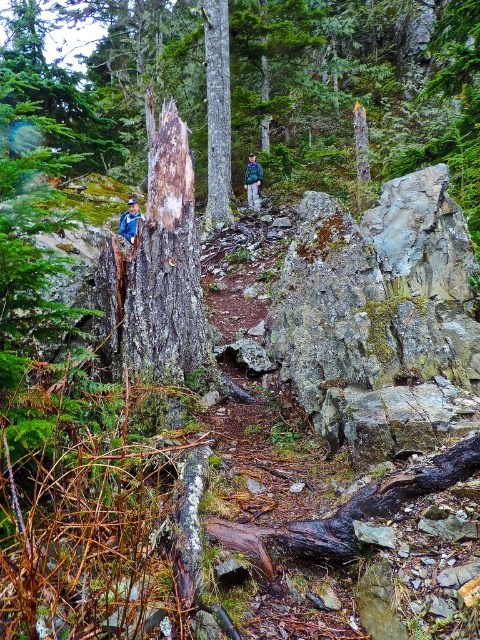
Can you confirm if gray mossy rock at upper center is positioned above blue denim jacket at left?

Actually, gray mossy rock at upper center is below blue denim jacket at left.

Is gray mossy rock at upper center smaller than blue denim jacket at left?

Incorrect, gray mossy rock at upper center is not smaller in size than blue denim jacket at left.

Does point (291, 259) come in front of point (132, 236)?

Yes.

Find the location of `gray mossy rock at upper center`. gray mossy rock at upper center is located at coordinates (377, 316).

Is gray mossy rock at upper center shorter than green fabric jacket at center?

No.

Is gray mossy rock at upper center further to camera compared to green fabric jacket at center?

No.

This screenshot has width=480, height=640. Identify the location of gray mossy rock at upper center. (377, 316).

Is smooth gray tree trunk at center below green fabric jacket at center?

No, smooth gray tree trunk at center is not below green fabric jacket at center.

Is smooth gray tree trunk at center wider than green fabric jacket at center?

Yes.

Is point (227, 22) in front of point (252, 170)?

Yes, it is.

Locate an element on the screen. This screenshot has height=640, width=480. smooth gray tree trunk at center is located at coordinates (217, 109).